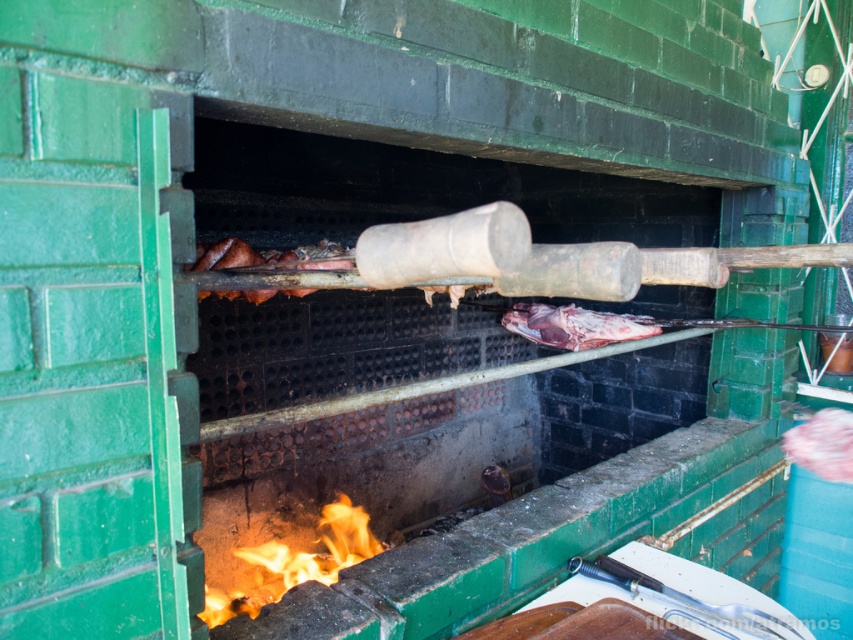
Which is more to the left, charcoal grill at center or flametransparentfire at lower center?

From the viewer's perspective, flametransparentfire at lower center appears more on the left side.

Is point (322, 458) positioned before point (332, 572)?

No, it is behind (332, 572).

Where is `charcoal grill at center`? The height and width of the screenshot is (640, 853). charcoal grill at center is located at coordinates (459, 438).

Who is shorter, flametransparentfire at lower center or raw red meat at center?

With less height is raw red meat at center.

Is flametransparentfire at lower center behind raw red meat at center?

No.

Does point (325, 524) come behind point (526, 308)?

No.

I want to click on flametransparentfire at lower center, so (296, 563).

Does charcoal grill at center have a greater height compared to raw red meat at center?

Indeed, charcoal grill at center has a greater height compared to raw red meat at center.

Does charcoal grill at center have a smaller size compared to raw red meat at center?

Actually, charcoal grill at center might be larger than raw red meat at center.

Is point (325, 323) positioned after point (613, 333)?

That is True.

The image size is (853, 640). What are the coordinates of `charcoal grill at center` in the screenshot? It's located at (459, 438).